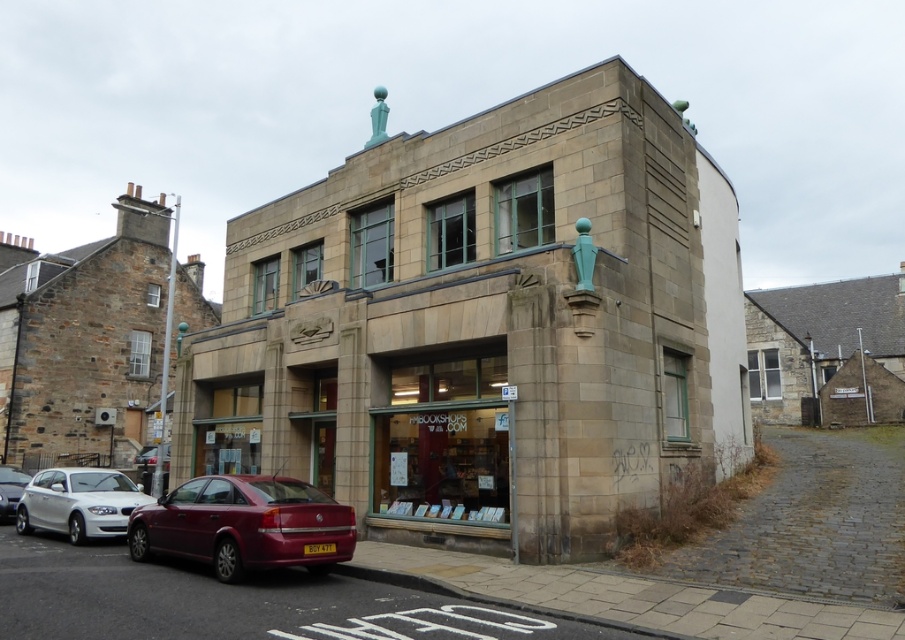
This screenshot has width=905, height=640. Find the location of `shiny red sedan at lower left`. shiny red sedan at lower left is located at coordinates (245, 525).

Is shiny red sedan at lower left bigger than white matte car at lower left?

No.

Which is in front, point (194, 547) or point (149, 497)?

Point (194, 547) is more forward.

Where is `shiny red sedan at lower left`? Image resolution: width=905 pixels, height=640 pixels. shiny red sedan at lower left is located at coordinates (245, 525).

Is stone building at center positioned in front of white glossy sedan at lower left?

That is True.

You are a GUI agent. You are given a task and a screenshot of the screen. Output one action in this format:
    pyautogui.click(x=<x>, y=<y>)
    Task: Click on the stone building at center
    
    Given the screenshot: What is the action you would take?
    pyautogui.click(x=486, y=324)

Can you confirm if white matte car at lower left is positioned above white glossy sedan at lower left?

No, white matte car at lower left is not above white glossy sedan at lower left.

Is white matte car at lower left positioned at the back of white glossy sedan at lower left?

No, white matte car at lower left is closer to the viewer.

Image resolution: width=905 pixels, height=640 pixels. In order to click on white matte car at lower left in this screenshot , I will do `click(78, 502)`.